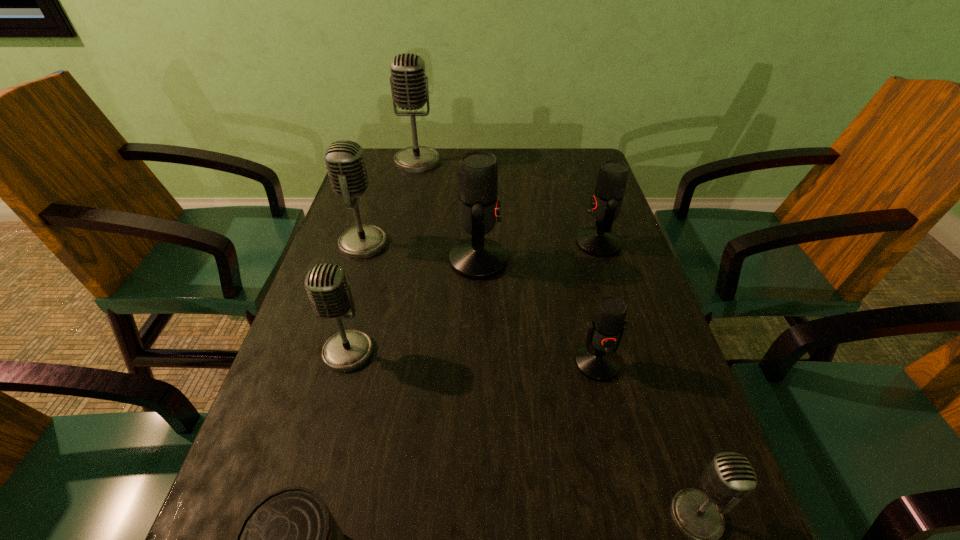
At what (x,y) coordinates should I click in order to perform the action: click on vacant space at the far right corner of the desktop. Please return your answer as a coordinate pair (x, y). The height and width of the screenshot is (540, 960). Looking at the image, I should click on (590, 158).

What are the coordinates of `empty space between the farthest gray microphone and the second nearest gray microphone` in the screenshot? It's located at (383, 256).

Locate an element on the screen. The width and height of the screenshot is (960, 540). free area in between the second farthest gray microphone and the tallest object is located at coordinates (391, 202).

Where is `free area in between the third biggest gray microphone and the second biggest red microphone`? Image resolution: width=960 pixels, height=540 pixels. free area in between the third biggest gray microphone and the second biggest red microphone is located at coordinates (473, 298).

The height and width of the screenshot is (540, 960). Find the location of `object that can be found as the second closest to the leftmost red microphone`. object that can be found as the second closest to the leftmost red microphone is located at coordinates (599, 241).

Select which object is the sixth closest to the second biggest red microphone. Please provide its 2D coordinates. Your answer should be formatted as a tuple, i.e. [(x, y)], where the tuple contains the x and y coordinates of a point satisfying the conditions above.

[(729, 478)]

Locate which microphone ranks in proximity to the fourth microphone from right to left. Please provide its 2D coordinates. Your answer should be formatted as a tuple, i.e. [(x, y)], where the tuple contains the x and y coordinates of a point satisfying the conditions above.

[(344, 159)]

Locate an element on the screen. microphone that is the second closest to the smallest gray microphone is located at coordinates (477, 258).

You are a GUI agent. You are given a task and a screenshot of the screen. Output one action in this format:
    pyautogui.click(x=<x>, y=<y>)
    Task: Click on the gray microphone that is the fourth closest one to the second biggest red microphone
    
    Given the screenshot: What is the action you would take?
    pos(729,478)

Locate an element on the screen. gray microphone that is the closest to the biggest gray microphone is located at coordinates (344, 159).